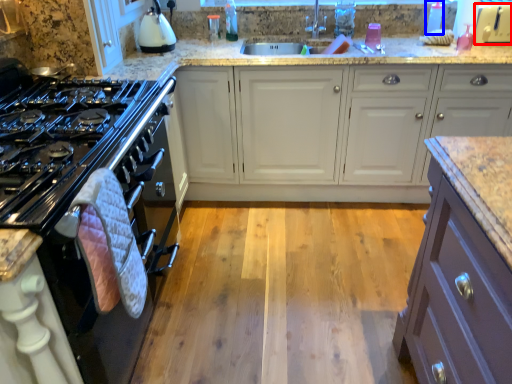
Question: Which of the following is the closest to the observer, appliance (highlighted by a red box) or bottle (highlighted by a blue box)?

Choices:
 (A) appliance
 (B) bottle

Answer: (A)